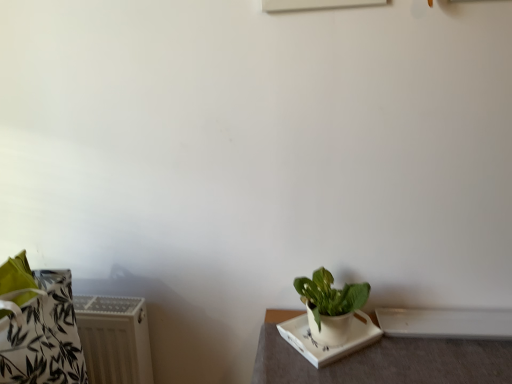
Locate an element on the screen. This screenshot has width=512, height=384. free space above white glossy window sill at lower right (from a real-world perspective) is located at coordinates (453, 321).